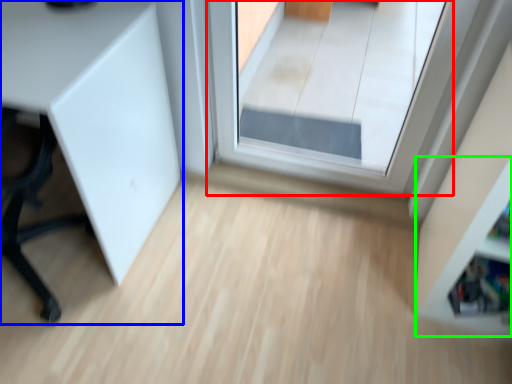
Question: Which object is positioned farthest from window (highlighted by a red box)? Select from furniture (highlighted by a blue box) and shelf (highlighted by a green box).

Choices:
 (A) furniture
 (B) shelf

Answer: (B)